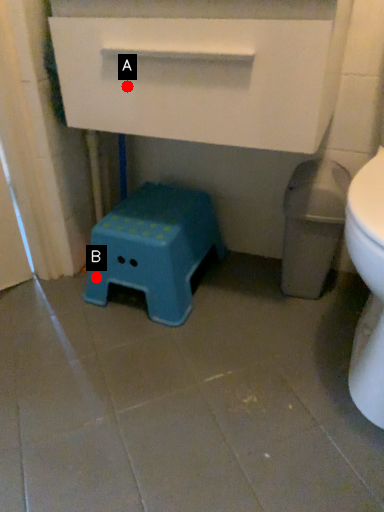
Question: Two points are circled on the image, labeled by A and B beside each circle. Which of the following is the farthest from the observer?

Choices:
 (A) A is further
 (B) B is further

Answer: (B)